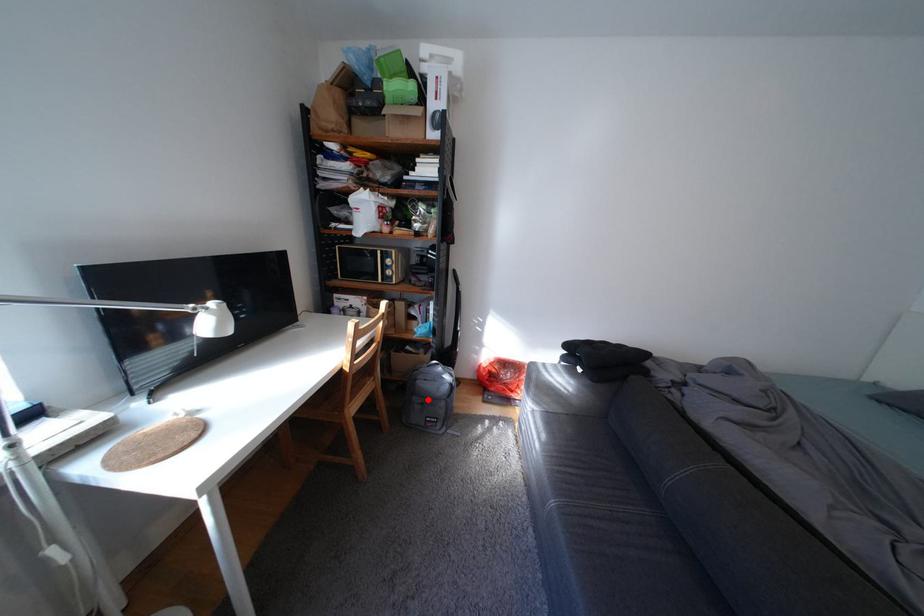
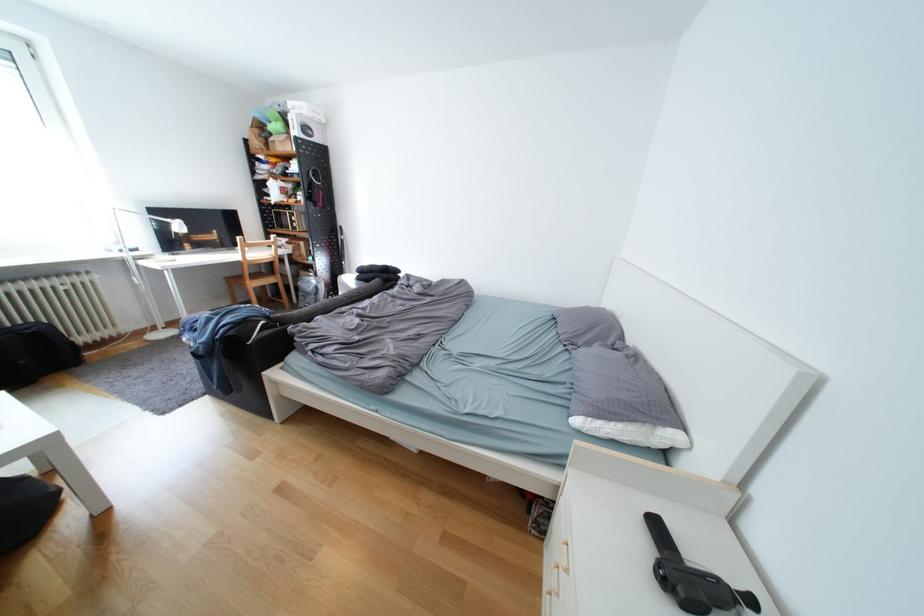
Find the pixel in the second image that matches the highlighted location in the first image.

(313, 294)